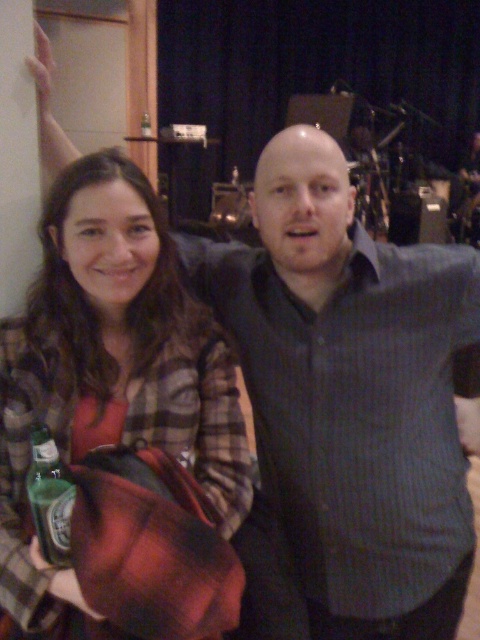
You are at a party and want to hand the green glass bottle at lower left to someone behind you. Can you do this without moving the plaid flannel shirt at left?

The plaid flannel shirt at left is in front of the green glass bottle at lower left, so you would need to move the plaid flannel shirt at left to access the green glass bottle at lower left and hand it to someone behind you.

You are standing in front of a photo of two people at an event. There are two points marked in the image. The first point is at coordinates point (222,486) and the second is at point (45,556). If you were to move closer to the camera, which point would appear closer to you?

Point (222,486) is further to the camera than point (45,556), so moving closer to the camera would make point (222,486) appear closer to you.